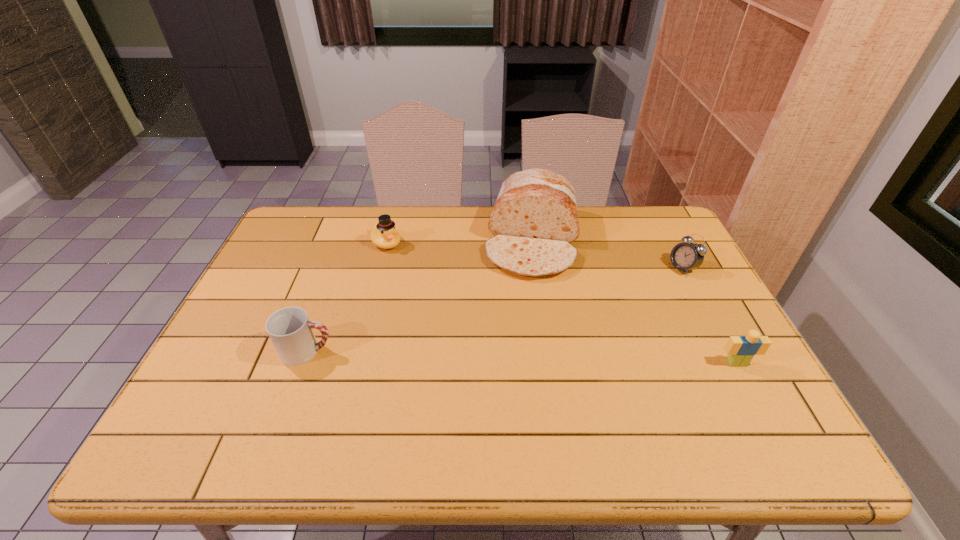
You are a GUI agent. You are given a task and a screenshot of the screen. Output one action in this format:
    pyautogui.click(x=<x>, y=<y>)
    Task: Click on the vacant space on the desktop that is between the leftmost object and the Lego and is positioned at the sliced end of the third object from right to left
    Image resolution: width=960 pixels, height=540 pixels.
    Given the screenshot: What is the action you would take?
    pyautogui.click(x=518, y=357)

The height and width of the screenshot is (540, 960). In order to click on vacant spot on the desktop that is between the cup and the Lego and is positioned on the front-facing side of the second object from left to right in this screenshot , I will do `click(491, 356)`.

Where is `free space on the desktop that is between the cup and the Lego and is positioned on the face of the alarm clock`? free space on the desktop that is between the cup and the Lego and is positioned on the face of the alarm clock is located at coordinates (490, 356).